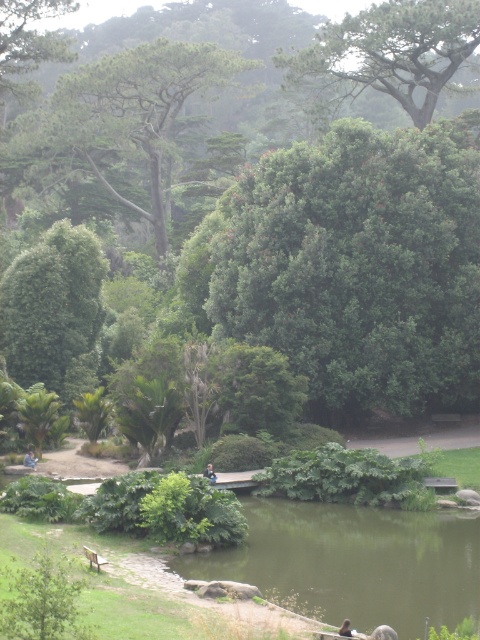
You are a park ranger who needs to retrieve a lost item. The blue denim jacket at center belongs to a visitor who reported it missing near the green textured tree at upper left. Based on the distance between them, can you estimate if the jacket was likely carried by wind from the tree area to its current position?

The green textured tree at upper left and the blue denim jacket at center are 68.24 meters apart from each other. Considering typical wind conditions in a park setting, it is unlikely the jacket was carried 68.24 meters by wind alone, as this distance exceeds normal wind drift capabilities for such an item.

You are a park visitor who wants to place a small potted plant between the blue denim jacket at center and the dark blue fabric jacket at center. Which jacket should the plant be closer to if you want it to be closer to the smaller jacket?

The blue denim jacket at center is smaller than the dark blue fabric jacket at center, so the plant should be placed closer to the blue denim jacket at center to be nearer to the smaller one.

You are a park visitor who wants to take a photo of the green textured tree at upper left and the blue denim jacket at center. Which object should you focus on first if you want to capture both in one frame without moving the camera?

The green textured tree at upper left is bigger than the blue denim jacket at center, so you should focus on the green textured tree at upper left first to ensure it fills the frame appropriately before adjusting for the smaller blue denim jacket at center.